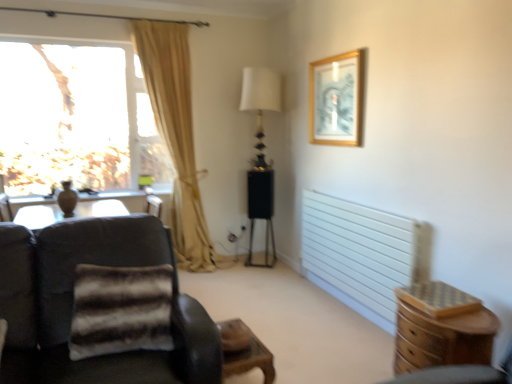
Question: Is wooden chest of drawers at lower right not close to white glossy table lamp at center?

Choices:
 (A) yes
 (B) no

Answer: (A)

Question: From a real-world perspective, does wooden chest of drawers at lower right sit lower than white glossy table lamp at center?

Choices:
 (A) no
 (B) yes

Answer: (B)

Question: Is wooden chest of drawers at lower right behind white glossy table lamp at center?

Choices:
 (A) no
 (B) yes

Answer: (A)

Question: Can you confirm if wooden chest of drawers at lower right is smaller than white glossy table lamp at center?

Choices:
 (A) yes
 (B) no

Answer: (A)

Question: Can you confirm if wooden chest of drawers at lower right is positioned to the right of white glossy table lamp at center?

Choices:
 (A) no
 (B) yes

Answer: (B)

Question: From the image's perspective, is beige fabric curtain at left positioned above or below dark brown leather chair at left?

Choices:
 (A) below
 (B) above

Answer: (B)

Question: Is beige fabric curtain at left taller or shorter than dark brown leather chair at left?

Choices:
 (A) short
 (B) tall

Answer: (B)

Question: In terms of width, does beige fabric curtain at left look wider or thinner when compared to dark brown leather chair at left?

Choices:
 (A) thin
 (B) wide

Answer: (A)

Question: Would you say beige fabric curtain at left is inside or outside dark brown leather chair at left?

Choices:
 (A) outside
 (B) inside

Answer: (A)

Question: In the image, is wooden chest of drawers at lower right positioned in front of or behind white matte radiator at right?

Choices:
 (A) front
 (B) behind

Answer: (A)

Question: In the image, is wooden chest of drawers at lower right on the left side or the right side of white matte radiator at right?

Choices:
 (A) right
 (B) left

Answer: (A)

Question: Looking at their shapes, would you say wooden chest of drawers at lower right is wider or thinner than white matte radiator at right?

Choices:
 (A) thin
 (B) wide

Answer: (B)

Question: Does point (446, 347) appear closer or farther from the camera than point (385, 254)?

Choices:
 (A) closer
 (B) farther

Answer: (A)

Question: In the image, is transparent glass window at upper left positioned in front of or behind white glossy table lamp at center?

Choices:
 (A) behind
 (B) front

Answer: (B)

Question: In the image, is transparent glass window at upper left on the left side or the right side of white glossy table lamp at center?

Choices:
 (A) left
 (B) right

Answer: (A)